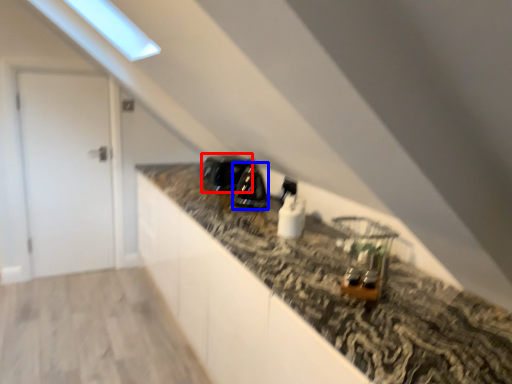
Question: Which object appears farthest to the camera in this image, appliance (highlighted by a red box) or appliance (highlighted by a blue box)?

Choices:
 (A) appliance
 (B) appliance

Answer: (A)